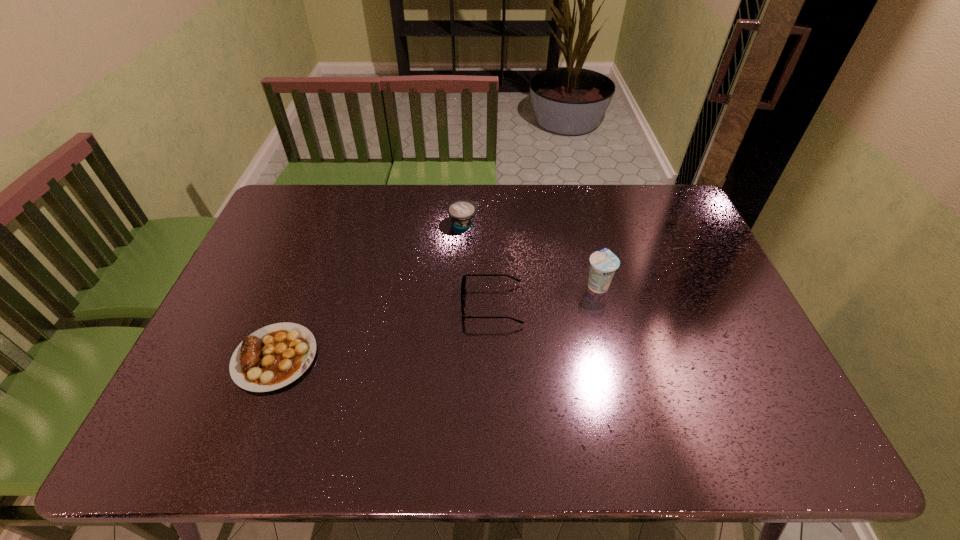
Locate an element on the screen. Image resolution: width=960 pixels, height=540 pixels. free region located 0.240m on the front-facing side of the spectacles is located at coordinates (376, 304).

Locate an element on the screen. The height and width of the screenshot is (540, 960). free region located on the front-facing side of the spectacles is located at coordinates (401, 304).

Find the location of a particular element. vacant region located on the back of the leftmost object is located at coordinates (303, 282).

This screenshot has width=960, height=540. Identify the location of object present at the far edge. (462, 212).

Locate an element on the screen. The width and height of the screenshot is (960, 540). object that is positioned at the left edge is located at coordinates (274, 356).

Identify the location of vacant space at the far edge. The height and width of the screenshot is (540, 960). (403, 198).

Where is `vacant space at the near edge`? This screenshot has height=540, width=960. vacant space at the near edge is located at coordinates (706, 423).

Find the location of a particular element. The width and height of the screenshot is (960, 540). vacant point at the left edge is located at coordinates (274, 287).

Identify the location of free space at the right edge of the desktop. The image size is (960, 540). (704, 249).

Find the location of a particular element. The height and width of the screenshot is (540, 960). blank space at the far left corner of the desktop is located at coordinates (285, 188).